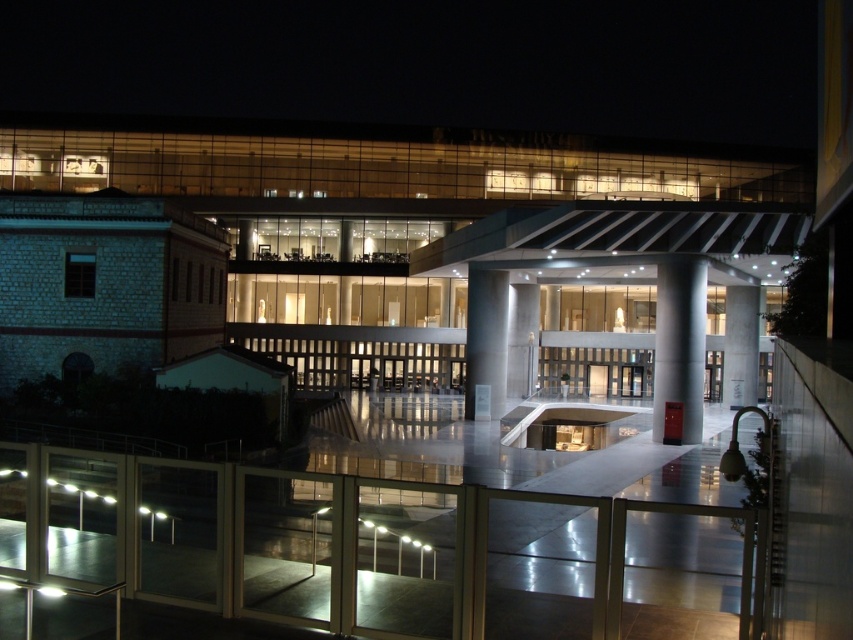
Question: Where is sleek metallic column at center located in relation to white glossy pillar at center in the image?

Choices:
 (A) above
 (B) below

Answer: (A)

Question: Which object is positioned closest to the white smooth pillar at center?

Choices:
 (A) sleek metallic column at center
 (B) white glossy pillar at center

Answer: (A)

Question: Which object is the closest to the white glossy pillar at center?

Choices:
 (A) sleek metallic column at center
 (B) white smooth pillar at center

Answer: (B)

Question: Does sleek metallic column at center have a larger size compared to white glossy pillar at center?

Choices:
 (A) yes
 (B) no

Answer: (A)

Question: Observing the image, what is the correct spatial positioning of white smooth pillar at center in reference to white glossy pillar at center?

Choices:
 (A) below
 (B) above

Answer: (A)

Question: Which of the following is the closest to the observer?

Choices:
 (A) [x=676, y=305]
 (B) [x=750, y=358]

Answer: (A)